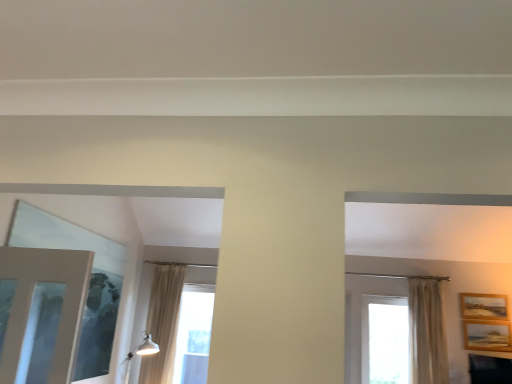
Where is `transparent glass window at center, arranged as the second window when viewed from the left`? Image resolution: width=512 pixels, height=384 pixels. transparent glass window at center, arranged as the second window when viewed from the left is located at coordinates (194, 334).

Considering the sizes of objects white glossy light fixture at lower left and transparent glass window at center, positioned as the 3th window in left-to-right order, in the image provided, who is smaller, white glossy light fixture at lower left or transparent glass window at center, positioned as the 3th window in left-to-right order,?

Smaller between the two is transparent glass window at center, positioned as the 3th window in left-to-right order.

Which point is more forward, (157,352) or (382,361)?

The point (382,361) is closer.

Considering the relative positions of white glossy light fixture at lower left and transparent glass window at center, the 1th window in the right-to-left sequence, in the image provided, is white glossy light fixture at lower left to the right of transparent glass window at center, the 1th window in the right-to-left sequence, from the viewer's perspective?

No, white glossy light fixture at lower left is not to the right of transparent glass window at center, the 1th window in the right-to-left sequence.

Can we say beige curtain at center, which is counted as the first window, starting from the left, lies outside transparent glass window at center, positioned as the 3th window in left-to-right order?

Yes.

Considering the relative positions of beige curtain at center, positioned as the 3th window in right-to-left order, and transparent glass window at center, positioned as the 3th window in left-to-right order, in the image provided, is beige curtain at center, positioned as the 3th window in right-to-left order, to the left or to the right of transparent glass window at center, positioned as the 3th window in left-to-right order,?

Clearly, beige curtain at center, positioned as the 3th window in right-to-left order, is on the left of transparent glass window at center, positioned as the 3th window in left-to-right order, in the image.

From the image's perspective, is beige curtain at center, positioned as the 3th window in right-to-left order, positioned above or below transparent glass window at center, positioned as the 3th window in left-to-right order?

beige curtain at center, positioned as the 3th window in right-to-left order, is above transparent glass window at center, positioned as the 3th window in left-to-right order.

Is wooden textured picture frame at right, the first picture frame from the bottom, next to transparent glass window at center, the 1th window in the right-to-left sequence, and touching it?

wooden textured picture frame at right, the first picture frame from the bottom, and transparent glass window at center, the 1th window in the right-to-left sequence, are clearly separated.

Is wooden textured picture frame at right, the first picture frame from the bottom, spatially inside transparent glass window at center, positioned as the 3th window in left-to-right order, or outside of it?

wooden textured picture frame at right, the first picture frame from the bottom, cannot be found inside transparent glass window at center, positioned as the 3th window in left-to-right order.

From the image's perspective, which one is positioned lower, wooden textured picture frame at right, which appears as the second picture frame when viewed from the top, or transparent glass window at center, positioned as the 3th window in left-to-right order?

transparent glass window at center, positioned as the 3th window in left-to-right order, from the image's perspective.

Which object is positioned more to the left, wooden textured picture frame at right, the first picture frame from the bottom, or transparent glass window at center, the 1th window in the right-to-left sequence?

transparent glass window at center, the 1th window in the right-to-left sequence, is more to the left.

Is transparent glass window at center, the 1th window in the right-to-left sequence, located outside white sheer curtain at right?

That's correct, transparent glass window at center, the 1th window in the right-to-left sequence, is outside of white sheer curtain at right.

From a real-world perspective, is transparent glass window at center, positioned as the 3th window in left-to-right order, below white sheer curtain at right?

Correct, in the physical world, transparent glass window at center, positioned as the 3th window in left-to-right order, is lower than white sheer curtain at right.

Is point (382, 331) farther from camera compared to point (441, 332)?

Yes, point (382, 331) is behind point (441, 332).

Is transparent glass window at center, the 1th window in the right-to-left sequence, thinner than white sheer curtain at right?

Yes, transparent glass window at center, the 1th window in the right-to-left sequence, is thinner than white sheer curtain at right.

Is wooden textured picture frame at right, the first picture frame from the bottom, closer to camera compared to beige curtain at center, which is counted as the first window, starting from the left?

Yes, the depth of wooden textured picture frame at right, the first picture frame from the bottom, is less than that of beige curtain at center, which is counted as the first window, starting from the left.

From a real-world perspective, is wooden textured picture frame at right, the first picture frame from the bottom, above or below beige curtain at center, which is counted as the first window, starting from the left?

Clearly, from a real-world perspective, wooden textured picture frame at right, the first picture frame from the bottom, is above beige curtain at center, which is counted as the first window, starting from the left.

Based on the photo, what's the angular difference between wooden textured picture frame at right, which appears as the second picture frame when viewed from the top, and beige curtain at center, which is counted as the first window, starting from the left,'s facing directions?

0.000365 degrees.

Which window is the 2nd one when counting from the back of the wooden textured picture frame at right, which appears as the second picture frame when viewed from the top? Please provide its 2D coordinates.

[(144, 297)]

Considering the sizes of objects transparent glass window at center, arranged as the second window when viewed from the left, and black glossy tv at lower right in the image provided, who is smaller, transparent glass window at center, arranged as the second window when viewed from the left, or black glossy tv at lower right?

A: With smaller size is black glossy tv at lower right.

Is transparent glass window at center, arranged as the second window when viewed from the left, taller or shorter than black glossy tv at lower right?

Considering their sizes, transparent glass window at center, arranged as the second window when viewed from the left, has more height than black glossy tv at lower right.

Between point (185, 299) and point (489, 380), which one is positioned behind?

The point (185, 299) is farther.

The image size is (512, 384). In order to click on the 2nd window to the left when counting from the black glossy tv at lower right in this screenshot , I will do `click(194, 334)`.

At what (x,y) coordinates should I click in order to perform the action: click on picture frame that is the 2nd one when counting rightward from the transparent glass window at center, positioned as the 3th window in left-to-right order. Please return your answer as a coordinate pair (x, y). The image size is (512, 384). Looking at the image, I should click on (483, 306).

Based on their sizes in the image, would you say wooden picture frame at upper right, which is the first picture frame in top-to-bottom order, is bigger or smaller than transparent glass window at center, positioned as the 3th window in left-to-right order?

Considering their sizes, wooden picture frame at upper right, which is the first picture frame in top-to-bottom order, takes up less space than transparent glass window at center, positioned as the 3th window in left-to-right order.

Is wooden picture frame at upper right, which is the first picture frame in top-to-bottom order, facing towards transparent glass window at center, the 1th window in the right-to-left sequence?

No, wooden picture frame at upper right, which is the first picture frame in top-to-bottom order, is not aimed at transparent glass window at center, the 1th window in the right-to-left sequence.

Considering the positions of point (495, 310) and point (380, 377), is point (495, 310) closer or farther from the camera than point (380, 377)?

Point (495, 310) is positioned closer to the camera compared to point (380, 377).

At what (x,y) coordinates should I click in order to perform the action: click on the 1st window behind the white glossy light fixture at lower left. Please return your answer as a coordinate pair (x, y). Looking at the image, I should click on (385, 340).

Find the location of a particular element. The height and width of the screenshot is (384, 512). window that is the 1st object located below the beige curtain at center, which is counted as the first window, starting from the left (from the image's perspective) is located at coordinates (385, 340).

Based on their spatial positions, is beige curtain at center, which is counted as the first window, starting from the left, or white glossy light fixture at lower left further from black glossy tv at lower right?

beige curtain at center, which is counted as the first window, starting from the left, is positioned further to the anchor black glossy tv at lower right.

Estimate the real-world distances between objects in this image. Which object is further from transparent glass window at center, the 2th window in the right-to-left sequence, wooden picture frame at upper right, which is the first picture frame in top-to-bottom order, or wooden textured picture frame at right, which appears as the second picture frame when viewed from the top?

Among the two, wooden picture frame at upper right, which is the first picture frame in top-to-bottom order, is located further to transparent glass window at center, the 2th window in the right-to-left sequence.

When comparing their distances from white glossy light fixture at lower left, does transparent glass window at center, the 2th window in the right-to-left sequence, or wooden picture frame at upper right, which is the second picture frame from bottom to top, seem further?

wooden picture frame at upper right, which is the second picture frame from bottom to top, is further to white glossy light fixture at lower left.

When comparing their distances from white sheer curtain at right, does wooden picture frame at upper right, which is the first picture frame in top-to-bottom order, or transparent glass window at center, arranged as the second window when viewed from the left, seem closer?

Among the two, wooden picture frame at upper right, which is the first picture frame in top-to-bottom order, is located nearer to white sheer curtain at right.

Based on their spatial positions, is beige curtain at center, which is counted as the first window, starting from the left, or white sheer curtain at right further from white glossy light fixture at lower left?

white sheer curtain at right is positioned further to the anchor white glossy light fixture at lower left.

Which object lies nearer to the anchor point black glossy tv at lower right, transparent glass window at center, arranged as the second window when viewed from the left, or white sheer curtain at right?

white sheer curtain at right lies closer to black glossy tv at lower right than the other object.

When comparing their distances from transparent glass window at center, the 1th window in the right-to-left sequence, does white glossy light fixture at lower left or wooden textured picture frame at right, which appears as the second picture frame when viewed from the top, seem closer?

Among the two, wooden textured picture frame at right, which appears as the second picture frame when viewed from the top, is located nearer to transparent glass window at center, the 1th window in the right-to-left sequence.

Looking at the image, which one is located closer to transparent glass window at center, the 2th window in the right-to-left sequence, black glossy tv at lower right or wooden picture frame at upper right, which is the first picture frame in top-to-bottom order?

The object closer to transparent glass window at center, the 2th window in the right-to-left sequence, is black glossy tv at lower right.

At what (x,y) coordinates should I click in order to perform the action: click on curtain located between transparent glass window at center, positioned as the 3th window in left-to-right order, and wooden textured picture frame at right, the first picture frame from the bottom, in the left-right direction. Please return your answer as a coordinate pair (x, y). Image resolution: width=512 pixels, height=384 pixels. Looking at the image, I should click on (426, 332).

I want to click on furniture between transparent glass window at center, positioned as the 3th window in left-to-right order, and wooden picture frame at upper right, which is the second picture frame from bottom to top, in the horizontal direction, so click(490, 370).

Locate an element on the screen. picture frame between white sheer curtain at right and wooden picture frame at upper right, which is the first picture frame in top-to-bottom order, in the horizontal direction is located at coordinates (487, 335).

This screenshot has width=512, height=384. Find the location of `curtain between white glossy light fixture at lower left and wooden textured picture frame at right, the first picture frame from the bottom, from left to right`. curtain between white glossy light fixture at lower left and wooden textured picture frame at right, the first picture frame from the bottom, from left to right is located at coordinates (426, 332).